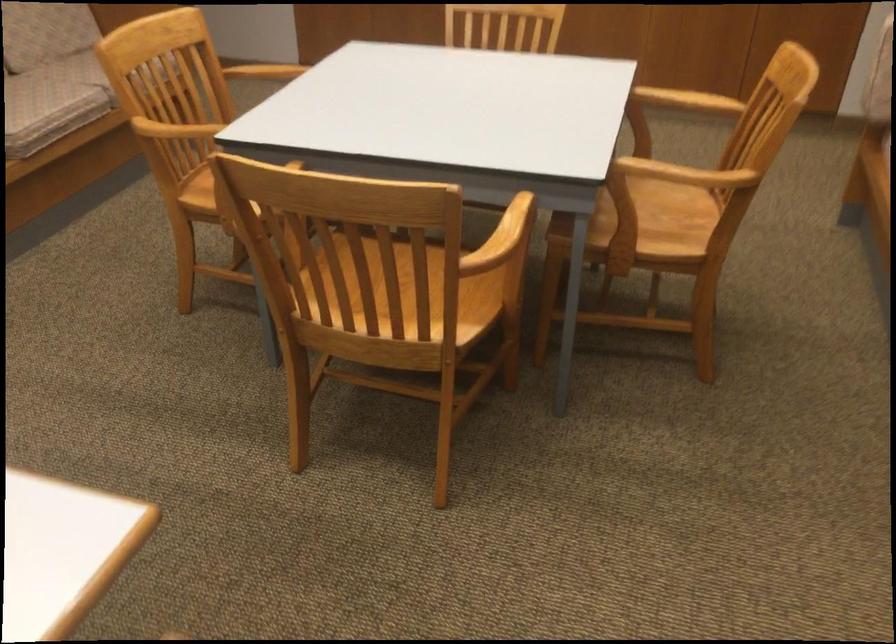
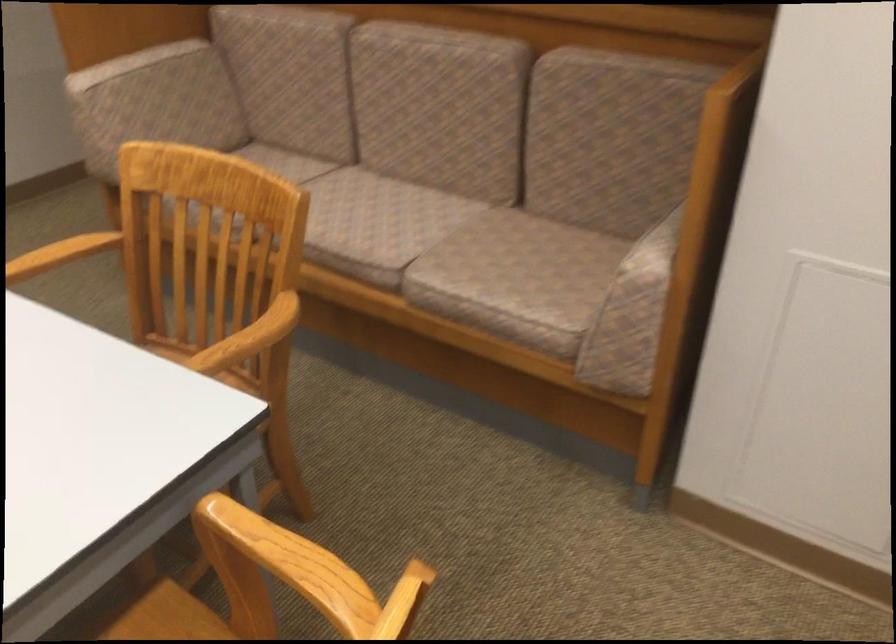
Where in the second image is the point corresponding to pixel 589 245 from the first image?

(259, 498)